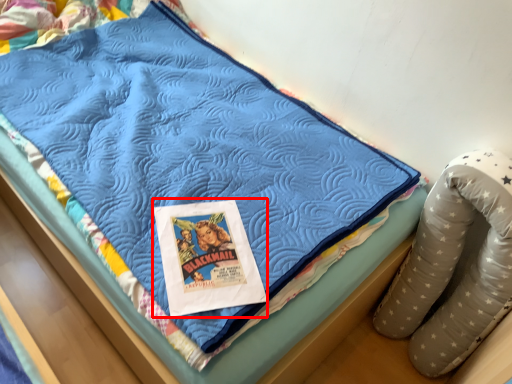
Question: From the image's perspective, considering the relative positions of comic book (annotated by the red box) and bean bag chair in the image provided, where is comic book (annotated by the red box) located with respect to the staircase?

Choices:
 (A) below
 (B) above

Answer: (B)